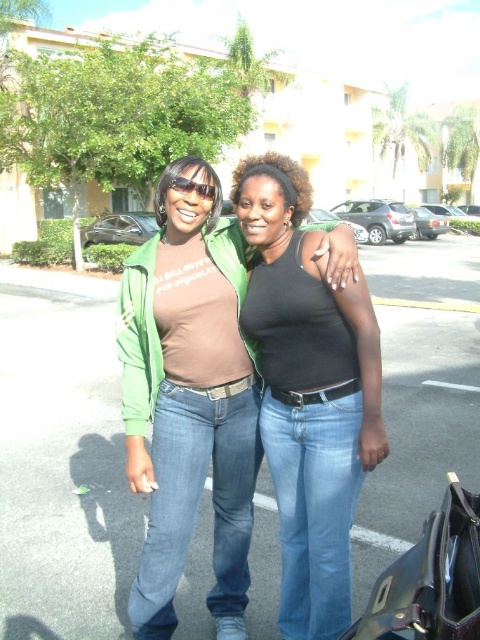
Does point (158, 369) come behind point (297, 212)?

That is False.

You are a GUI agent. You are given a task and a screenshot of the screen. Output one action in this format:
    pyautogui.click(x=<x>, y=<y>)
    Task: Click on the matte green jacket at center
    The height and width of the screenshot is (640, 480).
    Given the screenshot: What is the action you would take?
    pyautogui.click(x=189, y=397)

Which is behind, point (180, 467) or point (310, 196)?

Positioned behind is point (310, 196).

Where is `matte green jacket at center`? The image size is (480, 640). matte green jacket at center is located at coordinates pyautogui.click(x=189, y=397).

Which is below, blue jeans at center or matte green jacket at center?

matte green jacket at center is lower down.

Does blue jeans at center have a smaller size compared to matte green jacket at center?

Actually, blue jeans at center might be larger than matte green jacket at center.

Is point (23, 472) farther from viewer compared to point (210, 237)?

Yes.

Identify the location of blue jeans at center. (62, 460).

Which is in front, point (314, 545) or point (250, 168)?

Point (314, 545)

Can you confirm if black matte tank top at center is wider than dark brown curly hair at center?

Incorrect, black matte tank top at center's width does not surpass dark brown curly hair at center's.

Is point (288, 634) in front of point (264, 168)?

No, it is behind (264, 168).

The width and height of the screenshot is (480, 640). In order to click on black matte tank top at center in this screenshot , I will do `click(309, 394)`.